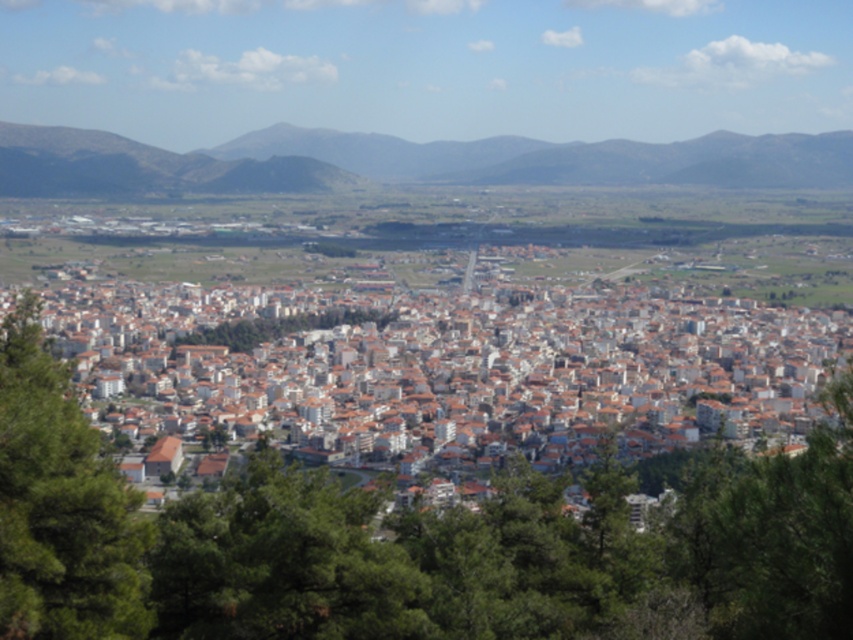
In the scene shown: Does white matte building at center have a greater width compared to dark brown rocky hillside at upper center?

In fact, white matte building at center might be narrower than dark brown rocky hillside at upper center.

Between white matte building at center and dark brown rocky hillside at upper center, which one appears on the right side from the viewer's perspective?

dark brown rocky hillside at upper center is more to the right.

Between point (780, 365) and point (169, 186), which one is positioned in front?

Point (169, 186) is more forward.

Where is `white matte building at center`? white matte building at center is located at coordinates (445, 378).

Is white matte building at center taller than green leafy tree at center?

Yes, white matte building at center is taller than green leafy tree at center.

Does point (405, 358) come in front of point (325, 314)?

Yes.

Where is `white matte building at center`? Image resolution: width=853 pixels, height=640 pixels. white matte building at center is located at coordinates (445, 378).

Can you confirm if green leafy tree at lower left is taller than green leafy tree at lower right?

Yes, green leafy tree at lower left is taller than green leafy tree at lower right.

Between green leafy tree at lower left and green leafy tree at lower right, which one appears on the right side from the viewer's perspective?

green leafy tree at lower right is more to the right.

The width and height of the screenshot is (853, 640). Describe the element at coordinates (61, 506) in the screenshot. I see `green leafy tree at lower left` at that location.

In order to click on green leafy tree at lower left in this screenshot , I will do `click(61, 506)`.